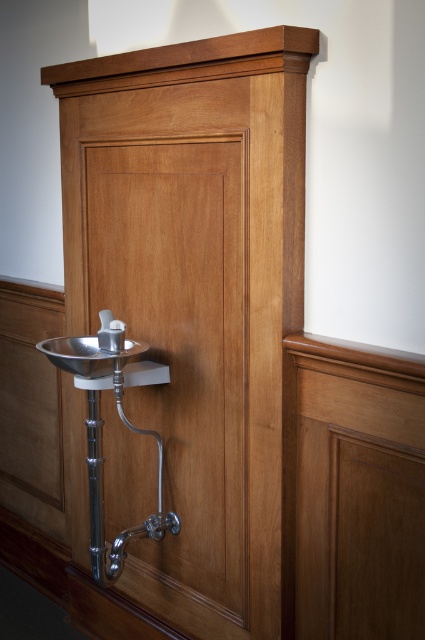
You are standing in front of the wall with the drinking fountain and need to locate two specific points on the wall. The first point is at coordinates point [88,364] and the second is at point [112,346]. Which of these two points is closer to you?

Point [88,364] is in front of point [112,346], so it is closer to you.

You are standing in front of the wall with the drinking fountain. There is a point marked at coordinates (87, 355). Based on the scene description, can you determine what object this point is located on?

The point at coordinates (87, 355) is located on the polished stainless steel sink at lower left.

You are a maintenance worker inspecting the wall mounted drinking fountain. You notice the polished stainless steel sink at lower left and the polished chrome faucet at center. Which object is located below the other?

The polished stainless steel sink at lower left is positioned under the polished chrome faucet at center, so the sink is below the faucet.